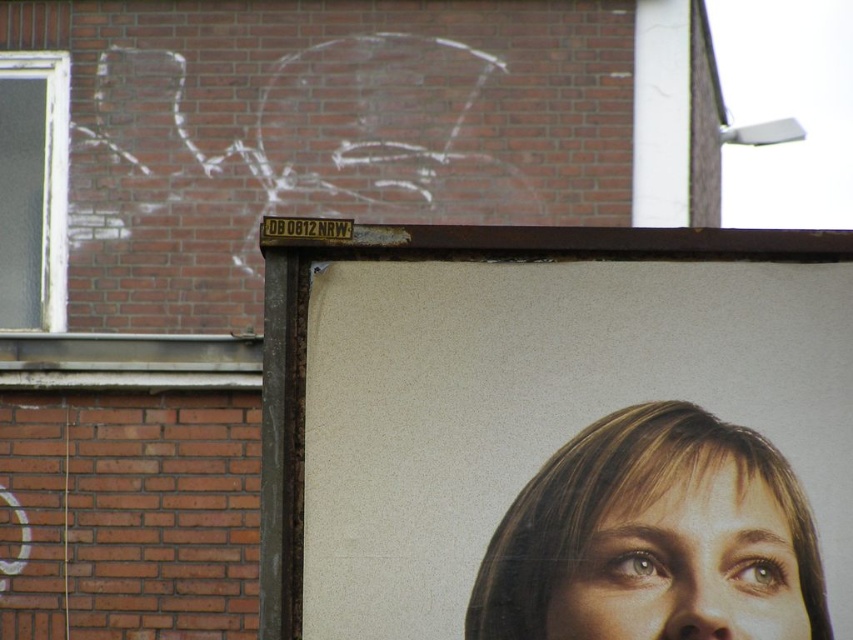
You are standing in front of the brick wall with the billboard. There are two points marked on the frame of the billboard. The first point is at coordinates point (587, 605) and the second is at point (595, 278). Which point is nearer to you?

Point (587, 605) is closer to the viewer than point (595, 278).

You are a photographer trying to capture both the smooth skin face at center and the matte paper poster at center in a single shot. Based on their positions, which object should you adjust your camera focus to first to ensure both are in frame?

The smooth skin face at center is to the right of the matte paper poster at center, so you should adjust your camera focus to the matte paper poster at center first to ensure both are in frame.

You are a photographer adjusting your camera settings. You notice a point at coordinates (654, 538) on your viewfinder. Based on the scene described, what does this point likely represent?

The point at coordinates (654, 538) corresponds to the smooth skin face at center, so it likely represents the central area of the person depicted in the image.